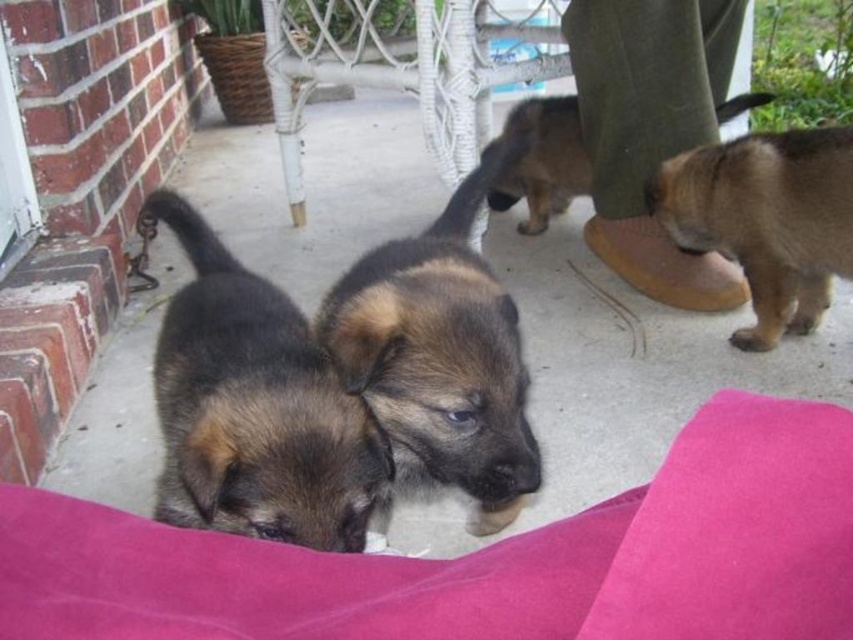
Question: Among these points, which one is farthest from the camera?

Choices:
 (A) [523, 193]
 (B) [514, 362]
 (C) [306, 492]
 (D) [798, 230]

Answer: (A)

Question: From the image, what is the correct spatial relationship of brown fur puppy at center in relation to brown fuzzy dog at center?

Choices:
 (A) above
 (B) below

Answer: (B)

Question: Which point appears closest to the camera in this image?

Choices:
 (A) (769, 138)
 (B) (181, 227)

Answer: (B)

Question: Which object is farther from the camera taking this photo?

Choices:
 (A) brown fur puppy at center
 (B) brown fuzzy dog at center
 (C) brown fuzzy puppy at lower left
 (D) brown fuzzy dog at right

Answer: (B)

Question: Is brown fuzzy puppy at lower left smaller than brown fur puppy at center?

Choices:
 (A) no
 (B) yes

Answer: (B)

Question: Can you confirm if brown fur puppy at center is positioned above brown fuzzy dog at right?

Choices:
 (A) no
 (B) yes

Answer: (A)